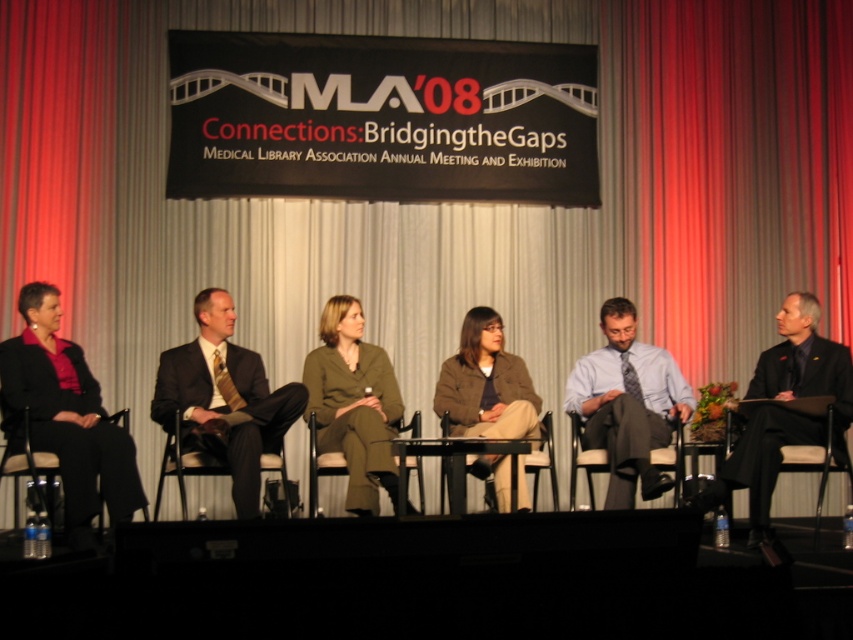
Question: Which object appears farthest from the camera in this image?

Choices:
 (A) green fabric dress at center
 (B) dark brown pinstripe suit at center
 (C) black satin suit at right
 (D) matte gray chair at center

Answer: (D)

Question: Estimate the real-world distances between objects in this image. Which object is closer to the matte black chair at center?

Choices:
 (A) brown fabric jacket at center
 (B) black fabric chair at left

Answer: (A)

Question: Does black satin suit at right appear under green fabric chair at center?

Choices:
 (A) no
 (B) yes

Answer: (A)

Question: Estimate the real-world distances between objects in this image. Which object is closer to the matte black blazer at left?

Choices:
 (A) green fabric dress at center
 (B) black fabric chair at left
 (C) brown fabric jacket at center
 (D) black satin suit at right

Answer: (B)

Question: Does matte black blazer at left lie behind black fabric chair at left?

Choices:
 (A) yes
 (B) no

Answer: (B)

Question: In this image, where is matte black blazer at left located relative to black satin suit at right?

Choices:
 (A) right
 (B) left

Answer: (B)